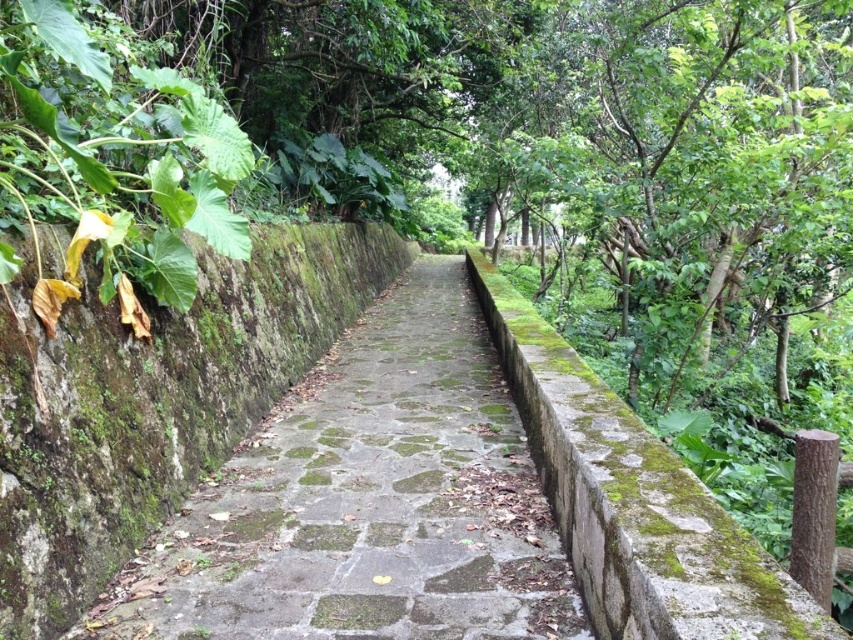
Is green mossy stone path at center smaller than green leafy plant at left?

Actually, green mossy stone path at center might be larger than green leafy plant at left.

Can you confirm if green mossy stone path at center is positioned above green leafy plant at left?

No.

Who is more distant from viewer, (242, 508) or (154, 246)?

Positioned behind is point (154, 246).

The height and width of the screenshot is (640, 853). In order to click on green mossy stone path at center in this screenshot , I will do `click(367, 500)`.